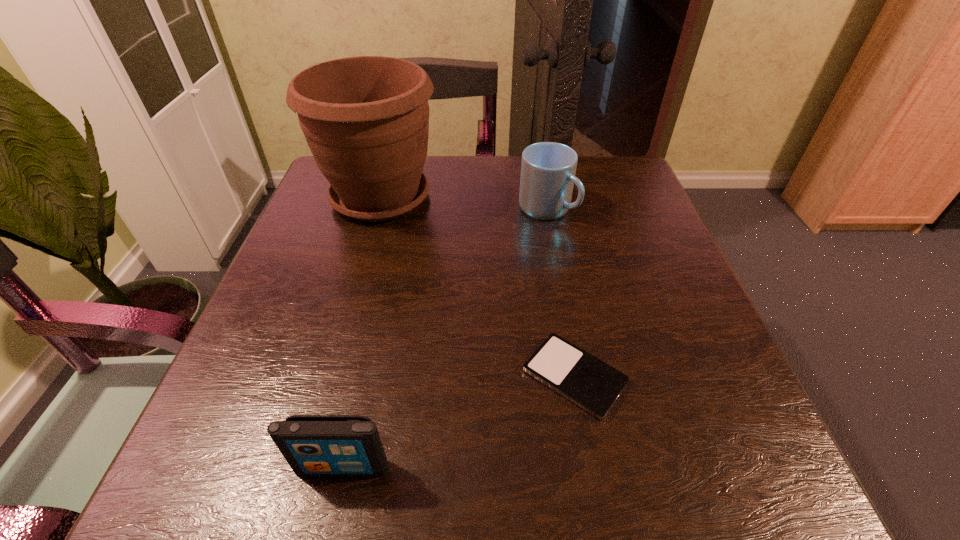
The height and width of the screenshot is (540, 960). I want to click on flowerpot, so click(x=366, y=119).

Locate an element on the screen. Image resolution: width=960 pixels, height=540 pixels. mug is located at coordinates (548, 169).

I want to click on the nearer iPod, so click(x=313, y=445).

You are a GUI agent. You are given a task and a screenshot of the screen. Output one action in this format:
    pyautogui.click(x=<x>, y=<y>)
    Task: Click on the nearest object
    
    Given the screenshot: What is the action you would take?
    pyautogui.click(x=313, y=445)

Image resolution: width=960 pixels, height=540 pixels. What are the coordinates of `the shortest object` in the screenshot? It's located at (593, 385).

This screenshot has height=540, width=960. Identify the location of the shorter iPod. (593, 385).

Locate an element on the screen. vacant space located on the front of the flowerpot is located at coordinates (346, 319).

This screenshot has height=540, width=960. What are the coordinates of `blank space located on the back of the mug` in the screenshot? It's located at (539, 164).

Find the location of a particular element. The width and height of the screenshot is (960, 540). vacant space located 0.070m on the back of the second nearest object is located at coordinates (562, 307).

Locate an element on the screen. This screenshot has height=540, width=960. flowerpot that is at the far edge is located at coordinates (366, 119).